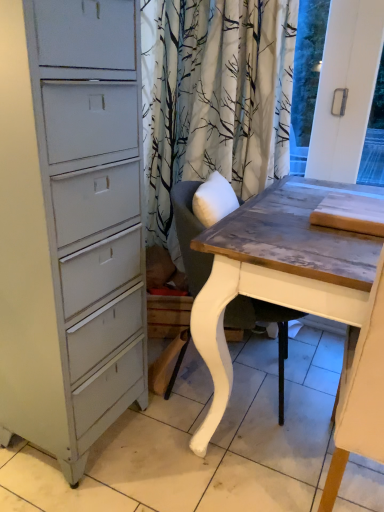
You are a GUI agent. You are given a task and a screenshot of the screen. Output one action in this format:
    pyautogui.click(x=<x>, y=<y>)
    Task: Click on the free region under wooden table at right (from a real-world perspective)
    
    Given the screenshot: What is the action you would take?
    [325, 472]